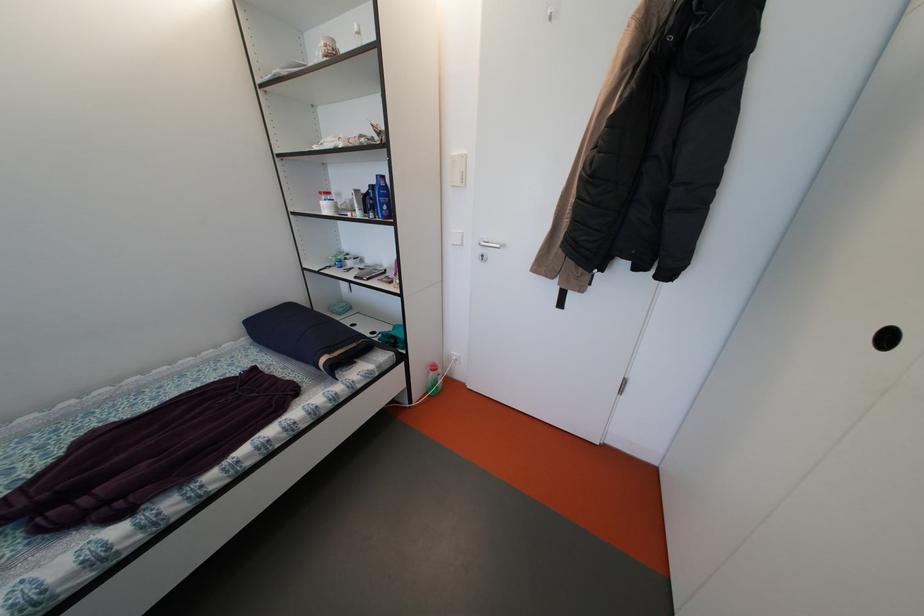
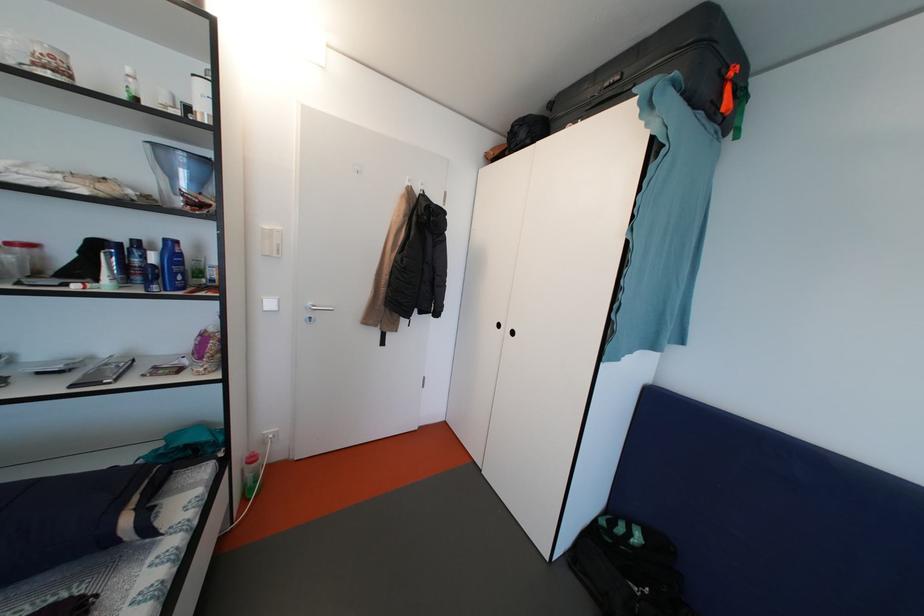
Question: Based on the continuous images, in which direction is the camera rotating? Reply with the corresponding letter.

Choices:
 (A) Left
 (B) Right
 (C) Up
 (D) Down

Answer: (B)